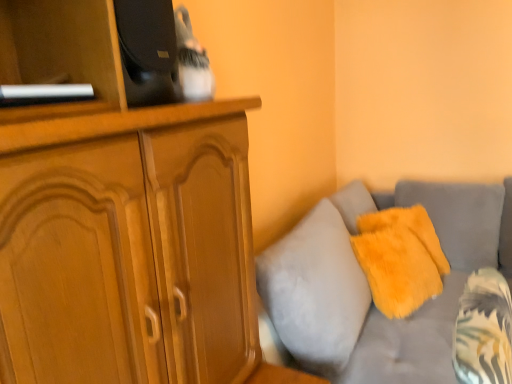
Image resolution: width=512 pixels, height=384 pixels. What do you see at coordinates (368, 286) in the screenshot?
I see `soft gray fabric couch at right` at bounding box center [368, 286].

What are the coordinates of `soft gray fabric couch at right` in the screenshot? It's located at click(x=368, y=286).

You are a GUI agent. You are given a task and a screenshot of the screen. Output one action in this format:
    pyautogui.click(x=<x>, y=<y>)
    Task: Click on the soft gray fabric couch at right
    
    Given the screenshot: What is the action you would take?
    pyautogui.click(x=368, y=286)